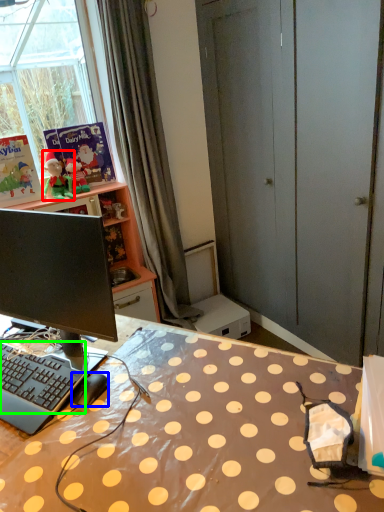
Question: Estimate the real-world distances between objects in this image. Which object is farther from person (highlighted by a red box), computer mouse (highlighted by a blue box) or computer keyboard (highlighted by a green box)?

Choices:
 (A) computer mouse
 (B) computer keyboard

Answer: (A)